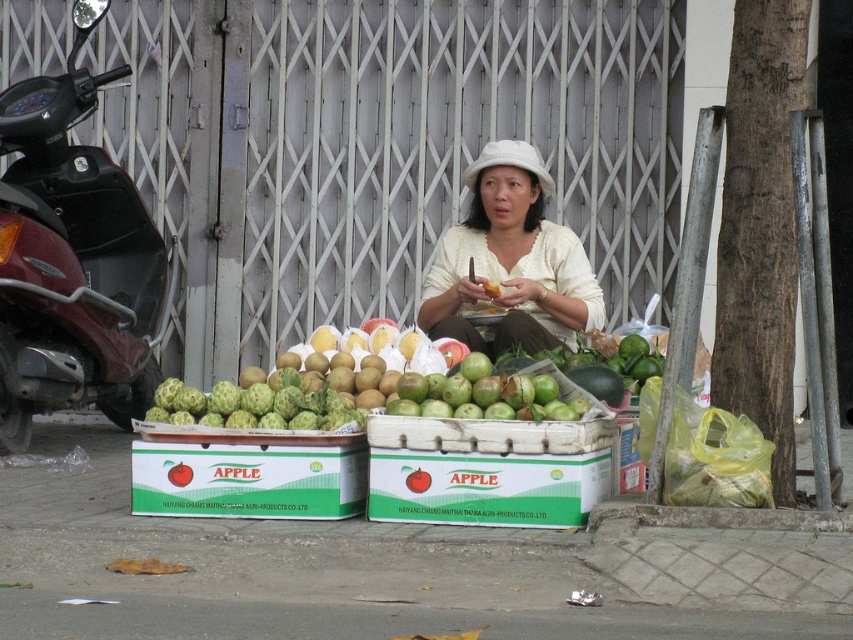
Can you confirm if green plastic crates at lower center is shorter than green rough skin at center?

Incorrect, green plastic crates at lower center's height does not fall short of green rough skin at center's.

Can you confirm if green plastic crates at lower center is positioned to the left of green rough skin at center?

In fact, green plastic crates at lower center is to the right of green rough skin at center.

This screenshot has width=853, height=640. Describe the element at coordinates (386, 570) in the screenshot. I see `green plastic crates at lower center` at that location.

Where is `green plastic crates at lower center`? This screenshot has height=640, width=853. green plastic crates at lower center is located at coordinates pos(386,570).

Is point (4, 451) closer to camera compared to point (351, 449)?

No, (4, 451) is behind (351, 449).

Does maroon metallic motorcycle at left have a lesser height compared to green matte apple box at center?

No.

Where is `maroon metallic motorcycle at left`? This screenshot has width=853, height=640. maroon metallic motorcycle at left is located at coordinates (73, 259).

Find the location of `maroon metallic motorcycle at left`. maroon metallic motorcycle at left is located at coordinates (73, 259).

Identify the location of green plastic crates at lower center. This screenshot has width=853, height=640. (386, 570).

Locate an element on the screen. green plastic crates at lower center is located at coordinates (386, 570).

Locate an element on the screen. This screenshot has height=640, width=853. green plastic crates at lower center is located at coordinates (386, 570).